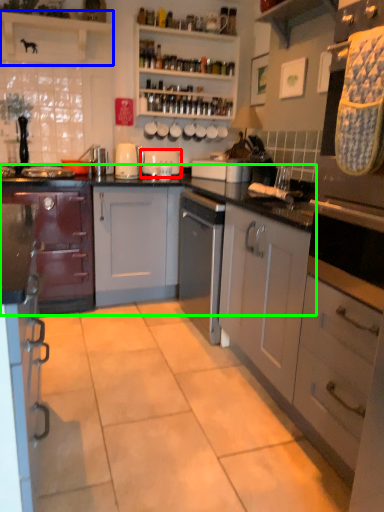
Question: Which object is the farthest from appliance (highlighted by a red box)? Choose among these: shelf (highlighted by a blue box) or cabinetry (highlighted by a green box).

Choices:
 (A) shelf
 (B) cabinetry

Answer: (A)